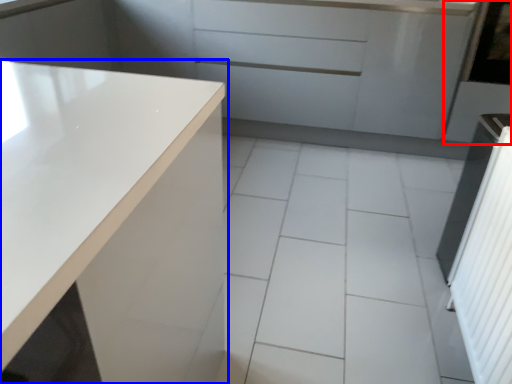
Question: Among these objects, which one is nearest to the camera, screen door (highlighted by a red box) or countertop (highlighted by a blue box)?

Choices:
 (A) screen door
 (B) countertop

Answer: (B)